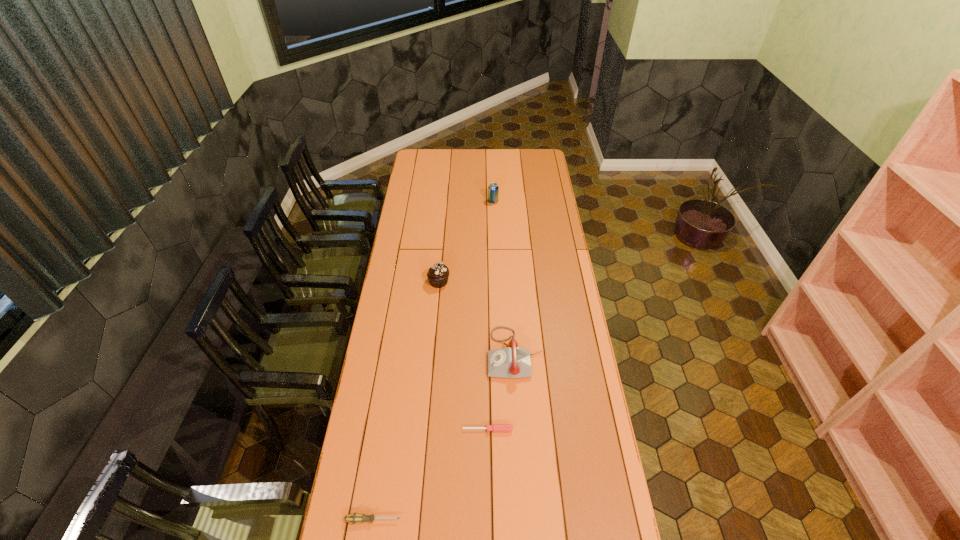
The height and width of the screenshot is (540, 960). Find the location of `vacant space that is in between the fourth tallest object and the third farthest object`. vacant space that is in between the fourth tallest object and the third farthest object is located at coordinates (444, 437).

The width and height of the screenshot is (960, 540). Find the location of `free area in between the nearer screwdriver and the fourth farthest object`. free area in between the nearer screwdriver and the fourth farthest object is located at coordinates (430, 475).

Identify the location of free space between the fourth farthest object and the fourth nearest object. The height and width of the screenshot is (540, 960). (464, 356).

Where is `free spot between the right screwdriver and the fourth nearest object`? This screenshot has height=540, width=960. free spot between the right screwdriver and the fourth nearest object is located at coordinates (464, 356).

Identify the location of free space between the fourth nearest object and the taller screwdriver. [x=406, y=401].

Identify the location of vacant space in between the telephone and the cupcake. (477, 318).

Locate an element on the screen. The height and width of the screenshot is (540, 960). empty location between the taller screwdriver and the fourth nearest object is located at coordinates (406, 401).

Where is `vacant area that lies between the beer can and the fourth farthest object`? This screenshot has width=960, height=540. vacant area that lies between the beer can and the fourth farthest object is located at coordinates (491, 316).

What are the coordinates of `unoccupied position between the farthest object and the fourth nearest object` in the screenshot? It's located at (466, 242).

Locate which object ranks third in proximity to the taller screwdriver. Please provide its 2D coordinates. Your answer should be formatted as a tuple, i.e. [(x, y)], where the tuple contains the x and y coordinates of a point satisfying the conditions above.

[(438, 274)]